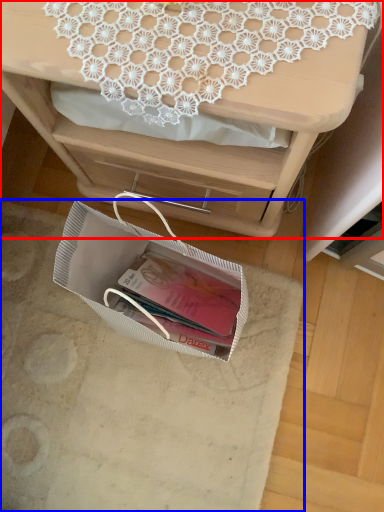
Question: Which object appears farthest to the camera in this image, desk (highlighted by a red box) or place mat (highlighted by a blue box)?

Choices:
 (A) desk
 (B) place mat

Answer: (B)